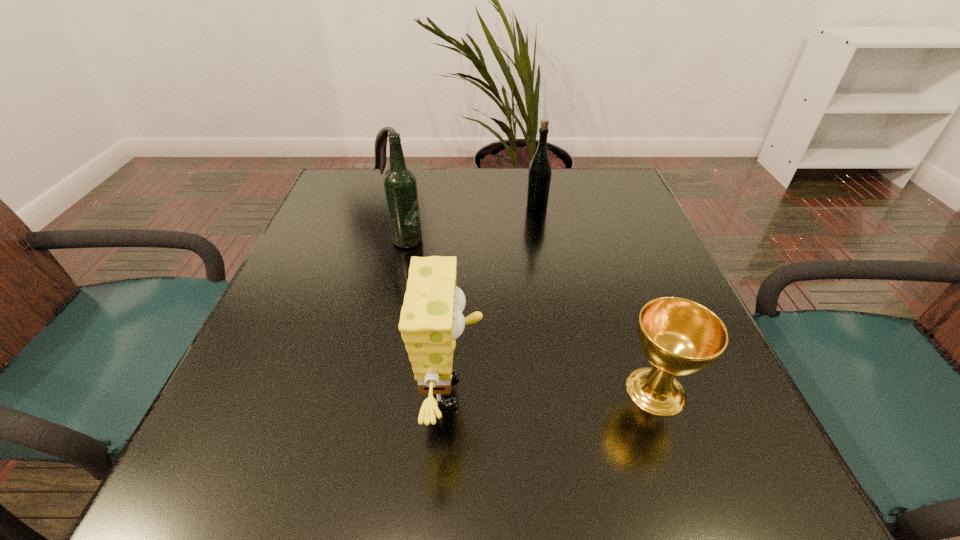
At what (x,y) coordinates should I click in order to perform the action: click on the tallest object. Please return your answer as a coordinate pair (x, y). This screenshot has height=540, width=960. Looking at the image, I should click on (400, 185).

The width and height of the screenshot is (960, 540). Find the location of `the second farthest object`. the second farthest object is located at coordinates (400, 185).

I want to click on the farther beer bottle, so click(539, 177).

Find the location of a particular element. The width and height of the screenshot is (960, 540). the right beer bottle is located at coordinates (539, 177).

Image resolution: width=960 pixels, height=540 pixels. I want to click on sponge, so click(x=431, y=318).

Find the location of a particular element. chalice is located at coordinates (680, 337).

The height and width of the screenshot is (540, 960). In order to click on the shortest object in this screenshot , I will do `click(680, 337)`.

Where is `vacant position located 0.270m on the back of the taller beer bottle`? vacant position located 0.270m on the back of the taller beer bottle is located at coordinates (417, 176).

The image size is (960, 540). What are the coordinates of `free location located 0.070m on the front of the shorter beer bottle` in the screenshot? It's located at (540, 230).

Where is `vacant space located 0.360m on the front-facing side of the sponge`? The image size is (960, 540). vacant space located 0.360m on the front-facing side of the sponge is located at coordinates (710, 392).